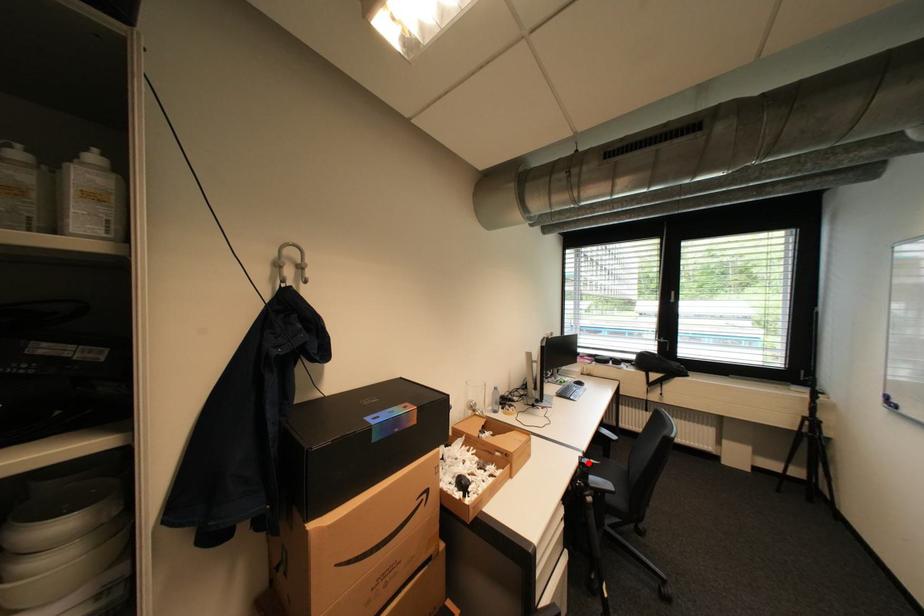
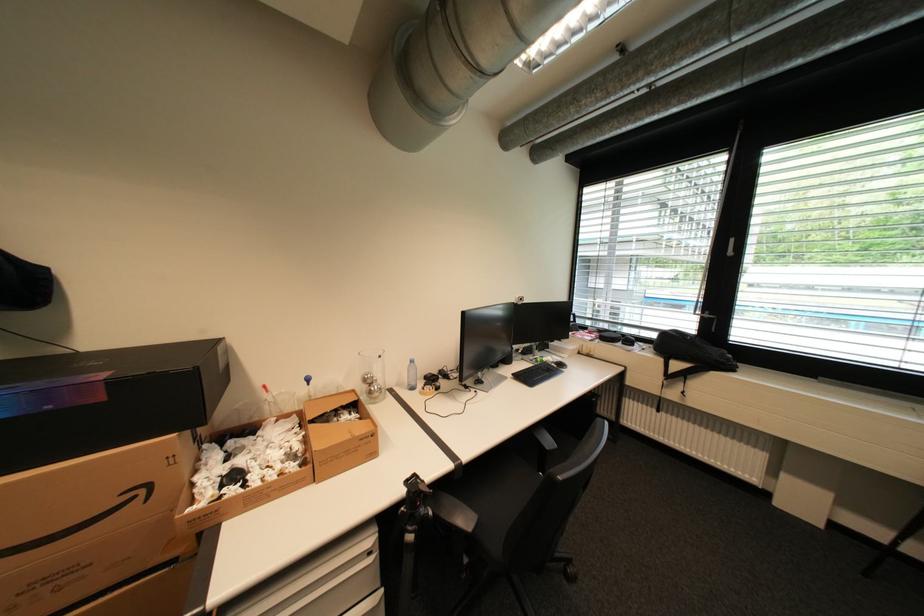
Question: I am providing you with two images of the same scene from different viewpoints. In image1, a red point is highlighted. Considering the same 3D point in image2, which of the following is correct?

Choices:
 (A) It is closer
 (B) It is farther

Answer: (B)